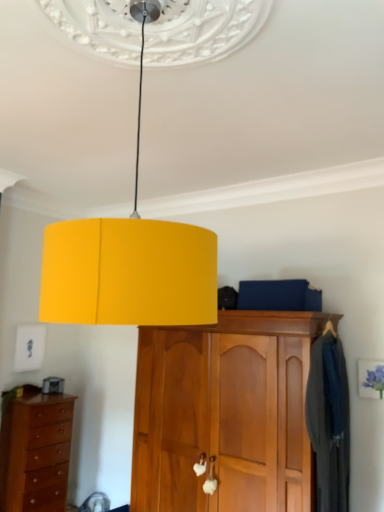
Question: Is brown wooden chest of drawers at lower left outside yellow matte lampshade at center?

Choices:
 (A) no
 (B) yes

Answer: (B)

Question: Does brown wooden chest of drawers at lower left have a larger size compared to yellow matte lampshade at center?

Choices:
 (A) yes
 (B) no

Answer: (B)

Question: Is brown wooden chest of drawers at lower left in contact with yellow matte lampshade at center?

Choices:
 (A) no
 (B) yes

Answer: (A)

Question: From a real-world perspective, is brown wooden chest of drawers at lower left positioned over yellow matte lampshade at center based on gravity?

Choices:
 (A) yes
 (B) no

Answer: (B)

Question: Would you consider brown wooden chest of drawers at lower left to be distant from yellow matte lampshade at center?

Choices:
 (A) yes
 (B) no

Answer: (A)

Question: Is brown wooden chest of drawers at lower left positioned in front of yellow matte lampshade at center?

Choices:
 (A) yes
 (B) no

Answer: (B)

Question: Is wooden cabinet at center positioned beyond the bounds of brown wooden chest of drawers at lower left?

Choices:
 (A) yes
 (B) no

Answer: (A)

Question: Considering the relative sizes of wooden cabinet at center and brown wooden chest of drawers at lower left in the image provided, is wooden cabinet at center taller than brown wooden chest of drawers at lower left?

Choices:
 (A) yes
 (B) no

Answer: (A)

Question: From the image's perspective, is wooden cabinet at center on top of brown wooden chest of drawers at lower left?

Choices:
 (A) yes
 (B) no

Answer: (A)

Question: Can you confirm if wooden cabinet at center is smaller than brown wooden chest of drawers at lower left?

Choices:
 (A) yes
 (B) no

Answer: (B)

Question: Is wooden cabinet at center touching brown wooden chest of drawers at lower left?

Choices:
 (A) yes
 (B) no

Answer: (B)

Question: Considering the relative positions of wooden cabinet at center and brown wooden chest of drawers at lower left in the image provided, is wooden cabinet at center in front of brown wooden chest of drawers at lower left?

Choices:
 (A) no
 (B) yes

Answer: (B)

Question: From a real-world perspective, is dark blue fabric coat at right physically below wooden cabinet at center?

Choices:
 (A) no
 (B) yes

Answer: (A)